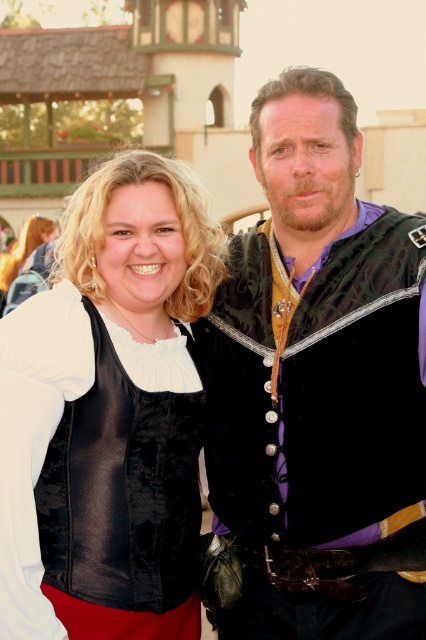
Question: Does velvet/black vest at center have a smaller size compared to velvet black vest at left?

Choices:
 (A) yes
 (B) no

Answer: (B)

Question: Is velvet/black vest at center wider than velvet black vest at left?

Choices:
 (A) yes
 (B) no

Answer: (A)

Question: In this image, where is velvet/black vest at center located relative to velvet black vest at left?

Choices:
 (A) below
 (B) above

Answer: (B)

Question: Which point is closer to the camera?

Choices:
 (A) velvet/black vest at center
 (B) velvet black vest at left

Answer: (B)

Question: Which of the following is the farthest from the observer?

Choices:
 (A) velvet/black vest at center
 (B) velvet black vest at left

Answer: (A)